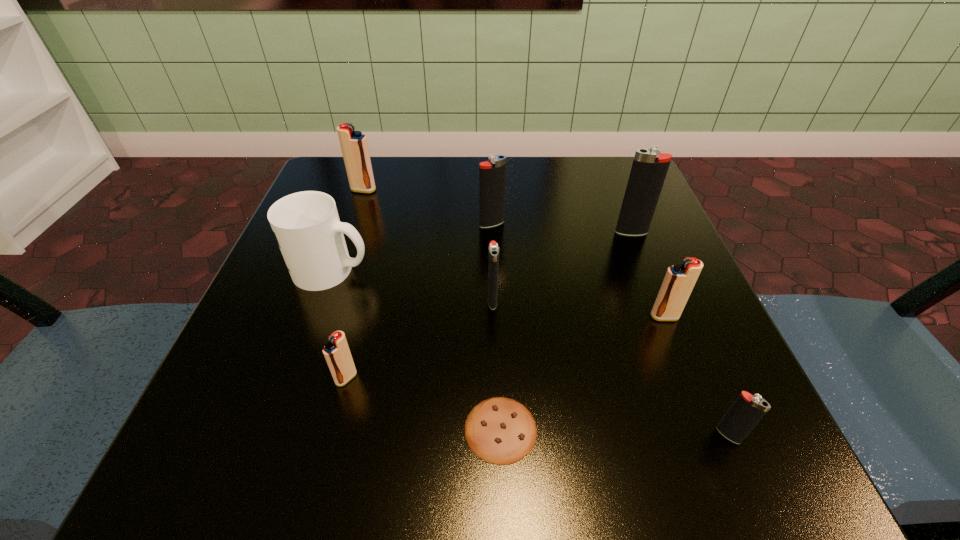
I want to click on free space that satisfies the following two spatial constraints: 1. on the handle side of the mug; 2. on the right side of the shortest object, so click(276, 429).